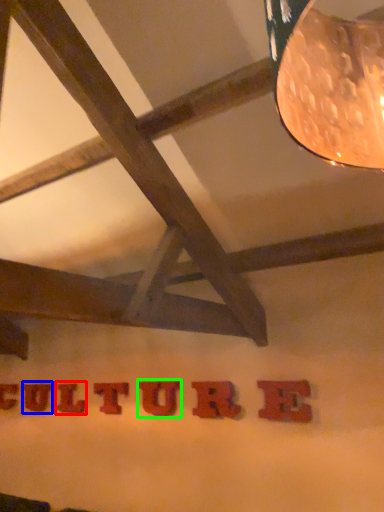
Question: Which object is positioned farthest from letter (highlighted by a red box)? Select from letter (highlighted by a blue box) and letter (highlighted by a green box).

Choices:
 (A) letter
 (B) letter

Answer: (B)